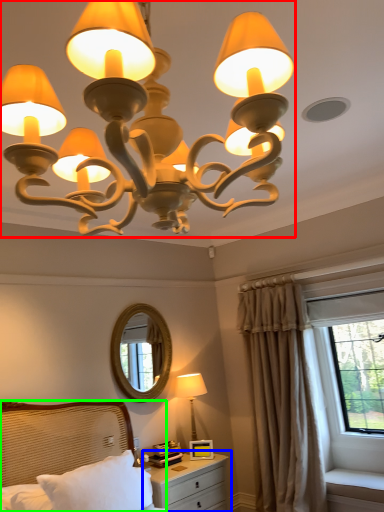
Question: Which object is the closest to the lamp (highlighted by a red box)? Choose among these: nightstand (highlighted by a blue box) or bed (highlighted by a green box).

Choices:
 (A) nightstand
 (B) bed

Answer: (B)